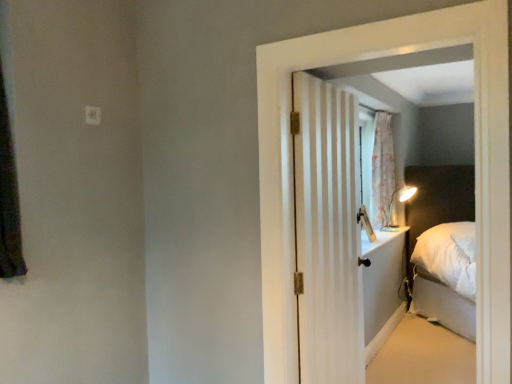
Describe the element at coordinates (93, 115) in the screenshot. This screenshot has width=512, height=384. I see `white plastic electrical outlet at upper left` at that location.

Where is `white plastic electrical outlet at upper left`? The height and width of the screenshot is (384, 512). white plastic electrical outlet at upper left is located at coordinates (93, 115).

The height and width of the screenshot is (384, 512). I want to click on white striped door at center, so click(x=328, y=233).

What do you see at coordinates (328, 233) in the screenshot?
I see `white striped door at center` at bounding box center [328, 233].

The height and width of the screenshot is (384, 512). Identify the location of white plastic electrical outlet at upper left. (93, 115).

Looking at this image, is white plastic electrical outlet at upper left at the right side of white striped door at center?

Incorrect, white plastic electrical outlet at upper left is not on the right side of white striped door at center.

Which object is further away from the camera, white plastic electrical outlet at upper left or white striped door at center?

white plastic electrical outlet at upper left is further from the camera.

Consider the image. Which is closer to the camera, (91, 118) or (304, 124)?

Point (304, 124)

From the image's perspective, is white plastic electrical outlet at upper left beneath white striped door at center?

No.

From a real-world perspective, which is physically above, white plastic electrical outlet at upper left or white striped door at center?

white plastic electrical outlet at upper left.

Is white plastic electrical outlet at upper left wider than white striped door at center?

No, white plastic electrical outlet at upper left is not wider than white striped door at center.

In terms of height, does white plastic electrical outlet at upper left look taller or shorter compared to white striped door at center?

white plastic electrical outlet at upper left is shorter than white striped door at center.

Does white plastic electrical outlet at upper left have a smaller size compared to white striped door at center?

Indeed, white plastic electrical outlet at upper left has a smaller size compared to white striped door at center.

Is white plastic electrical outlet at upper left not within white striped door at center?

Yes, white plastic electrical outlet at upper left is not within white striped door at center.

Is white plastic electrical outlet at upper left far away from white striped door at center?

Yes, white plastic electrical outlet at upper left and white striped door at center are located far from each other.

Is white plastic electrical outlet at upper left turned away from white striped door at center?

No, white striped door at center is not at the back of white plastic electrical outlet at upper left.

From the picture: How much distance is there between white plastic electrical outlet at upper left and white striped door at center?

white plastic electrical outlet at upper left and white striped door at center are 4.35 feet apart.

In the image, there is a white plastic electrical outlet at upper left. In order to click on door below it (from a real-world perspective) in this screenshot , I will do `click(328, 233)`.

Does white striped door at center appear on the right side of white plastic electrical outlet at upper left?

Correct, you'll find white striped door at center to the right of white plastic electrical outlet at upper left.

Between white striped door at center and white plastic electrical outlet at upper left, which one is positioned in front?

white striped door at center is closer to the camera.

Which is closer, (345, 205) or (95, 112)?

Clearly, point (345, 205) is more distant from the camera than point (95, 112).

From the image's perspective, is white striped door at center beneath white plastic electrical outlet at upper left?

Yes, from the image's perspective, white striped door at center is beneath white plastic electrical outlet at upper left.

From a real-world perspective, is white striped door at center located beneath white plastic electrical outlet at upper left?

Correct, in the physical world, white striped door at center is lower than white plastic electrical outlet at upper left.

Considering the sizes of white striped door at center and white plastic electrical outlet at upper left in the image, is white striped door at center wider or thinner than white plastic electrical outlet at upper left?

white striped door at center is wider than white plastic electrical outlet at upper left.

Looking at this image, who is shorter, white striped door at center or white plastic electrical outlet at upper left?

white plastic electrical outlet at upper left.

Which of these two, white striped door at center or white plastic electrical outlet at upper left, is bigger?

With larger size is white striped door at center.

Is white striped door at center situated inside white plastic electrical outlet at upper left or outside?

white striped door at center is not enclosed by white plastic electrical outlet at upper left.

Are white striped door at center and white plastic electrical outlet at upper left making contact?

No, white striped door at center is not beside white plastic electrical outlet at upper left.

Is white striped door at center looking in the opposite direction of white plastic electrical outlet at upper left?

No, white striped door at center is not facing away from white plastic electrical outlet at upper left.

Can you tell me how much white striped door at center and white plastic electrical outlet at upper left differ in facing direction?

They differ by 0.654 degrees in their facing directions.

Identify the location of electric outlet above the white striped door at center (from the image's perspective). (93, 115).

You are a GUI agent. You are given a task and a screenshot of the screen. Output one action in this format:
    pyautogui.click(x=<x>, y=<y>)
    Task: Click on the electric outlet behind the white striped door at center
    
    Given the screenshot: What is the action you would take?
    pyautogui.click(x=93, y=115)

Locate an element on the screen. This screenshot has height=384, width=512. door in front of the white plastic electrical outlet at upper left is located at coordinates (328, 233).